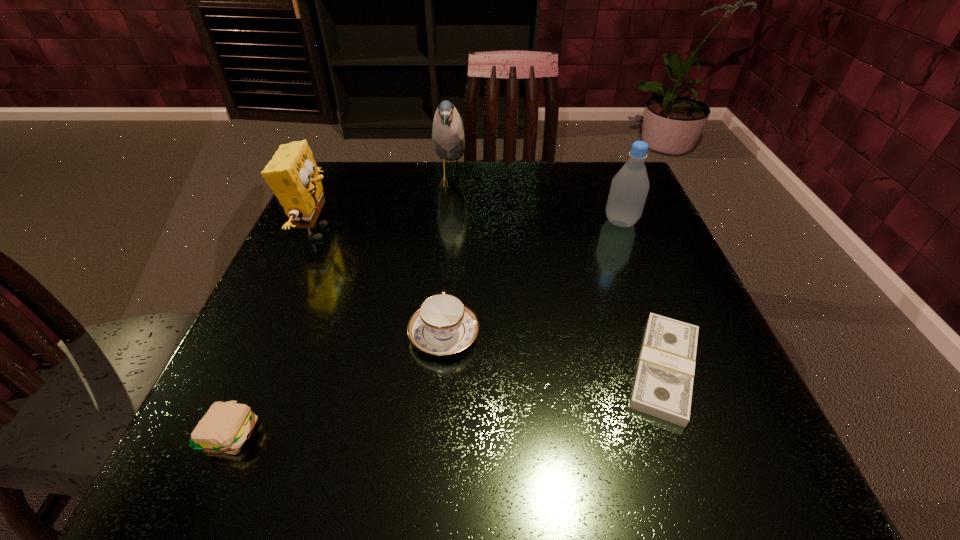
I want to click on object that stands as the second closest to the patty, so click(292, 174).

Locate which object is the fourth closest to the teacup. Please provide its 2D coordinates. Your answer should be formatted as a tuple, i.e. [(x, y)], where the tuple contains the x and y coordinates of a point satisfying the conditions above.

[(448, 138)]

You are a GUI agent. You are given a task and a screenshot of the screen. Output one action in this format:
    pyautogui.click(x=<x>, y=<y>)
    Task: Click on the vacant space that satisfies the following two spatial constraints: 1. on the face of the patty; 2. on the left side of the sponge
    This screenshot has height=540, width=960.
    Given the screenshot: What is the action you would take?
    pyautogui.click(x=228, y=433)

Find the location of `vacant space that satisfies the following two spatial constraints: 1. on the side with the handle of the third shortest object; 2. on the face of the sponge`. vacant space that satisfies the following two spatial constraints: 1. on the side with the handle of the third shortest object; 2. on the face of the sponge is located at coordinates [452, 232].

Where is `vacant region that satisfies the following two spatial constraints: 1. on the face of the dollar; 2. on the right side of the sponge`? The image size is (960, 540). vacant region that satisfies the following two spatial constraints: 1. on the face of the dollar; 2. on the right side of the sponge is located at coordinates (256, 369).

Where is `vacant position in the image that satisfies the following two spatial constraints: 1. at the tip of the bottle's beak; 2. on the right side of the farthest object`? vacant position in the image that satisfies the following two spatial constraints: 1. at the tip of the bottle's beak; 2. on the right side of the farthest object is located at coordinates (446, 222).

Locate an element on the screen. vacant space that satisfies the following two spatial constraints: 1. on the face of the sponge; 2. on the left side of the shortest object is located at coordinates (256, 369).

At what (x,y) coordinates should I click in order to perform the action: click on free space that satisfies the following two spatial constraints: 1. on the side with the handle of the fourth tallest object; 2. at the tip of the farthest object's beak. Please return your answer as a coordinate pair (x, y). The width and height of the screenshot is (960, 540). Looking at the image, I should click on (456, 181).

You are a GUI agent. You are given a task and a screenshot of the screen. Output one action in this format:
    pyautogui.click(x=<x>, y=<y>)
    Task: Click on the free spot that satisfies the following two spatial constraints: 1. on the face of the patty; 2. on the left side of the sponge
    This screenshot has height=540, width=960.
    Given the screenshot: What is the action you would take?
    pyautogui.click(x=228, y=433)

I want to click on vacant space that satisfies the following two spatial constraints: 1. on the face of the second shortest object; 2. on the right side of the sponge, so click(228, 433).